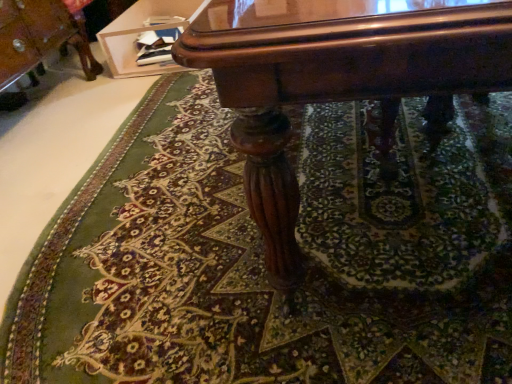
Describe the element at coordinates (143, 32) in the screenshot. I see `wooden glossy vanity at upper center` at that location.

This screenshot has height=384, width=512. What are the coordinates of `wooden glossy vanity at upper center` in the screenshot? It's located at (143, 32).

Measure the distance between wooden glossy vanity at upper center and camera.

wooden glossy vanity at upper center and camera are 8.60 feet apart from each other.

The height and width of the screenshot is (384, 512). Describe the element at coordinates (336, 80) in the screenshot. I see `glossy wood table at center` at that location.

The width and height of the screenshot is (512, 384). Identify the location of glossy wood table at center. (336, 80).

Identify the location of wooden glossy vanity at upper center. This screenshot has width=512, height=384. (143, 32).

Would you say glossy wood table at center is to the left or to the right of wooden glossy vanity at upper center in the picture?

glossy wood table at center is to the right of wooden glossy vanity at upper center.

Is the depth of glossy wood table at center greater than that of wooden glossy vanity at upper center?

No, it is not.

Is point (316, 4) in front of point (183, 25)?

Yes, point (316, 4) is in front of point (183, 25).

From the image's perspective, is glossy wood table at center located above wooden glossy vanity at upper center?

No.

From a real-world perspective, which is physically above, glossy wood table at center or wooden glossy vanity at upper center?

glossy wood table at center.

Considering the relative sizes of glossy wood table at center and wooden glossy vanity at upper center in the image provided, is glossy wood table at center wider than wooden glossy vanity at upper center?

Yes, glossy wood table at center is wider than wooden glossy vanity at upper center.

Based on the photo, between glossy wood table at center and wooden glossy vanity at upper center, which one has less height?

wooden glossy vanity at upper center is shorter.

Does glossy wood table at center have a smaller size compared to wooden glossy vanity at upper center?

Incorrect, glossy wood table at center is not smaller in size than wooden glossy vanity at upper center.

Is wooden glossy vanity at upper center inside glossy wood table at center?

Actually, wooden glossy vanity at upper center is outside glossy wood table at center.

Can you see glossy wood table at center touching wooden glossy vanity at upper center?

No, glossy wood table at center is not touching wooden glossy vanity at upper center.

Is glossy wood table at center turned away from wooden glossy vanity at upper center?

No.

How many degrees apart are the facing directions of glossy wood table at center and wooden glossy vanity at upper center?

179 degrees separate the facing orientations of glossy wood table at center and wooden glossy vanity at upper center.

Measure the distance from glossy wood table at center to wooden glossy vanity at upper center.

7.18 feet.

At what (x,y) coordinates should I click in order to perform the action: click on table on the right of wooden glossy vanity at upper center. Please return your answer as a coordinate pair (x, y). This screenshot has width=512, height=384. Looking at the image, I should click on (336, 80).

Between wooden glossy vanity at upper center and glossy wood table at center, which one appears on the left side from the viewer's perspective?

From the viewer's perspective, wooden glossy vanity at upper center appears more on the left side.

Considering their positions, is wooden glossy vanity at upper center located in front of or behind glossy wood table at center?

wooden glossy vanity at upper center is positioned farther from the viewer than glossy wood table at center.

Between point (119, 51) and point (259, 45), which one is positioned behind?

Positioned behind is point (119, 51).

From the image's perspective, which object appears higher, wooden glossy vanity at upper center or glossy wood table at center?

wooden glossy vanity at upper center.

From a real-world perspective, relative to glossy wood table at center, is wooden glossy vanity at upper center vertically above or below?

In terms of real-world spatial position, wooden glossy vanity at upper center is below glossy wood table at center.

Is wooden glossy vanity at upper center thinner than glossy wood table at center?

Correct, the width of wooden glossy vanity at upper center is less than that of glossy wood table at center.

In the scene shown: Can you confirm if wooden glossy vanity at upper center is taller than glossy wood table at center?

No.

Is wooden glossy vanity at upper center bigger or smaller than glossy wood table at center?

wooden glossy vanity at upper center is smaller than glossy wood table at center.

Could glossy wood table at center be considered to be inside wooden glossy vanity at upper center?

That's incorrect, glossy wood table at center is not inside wooden glossy vanity at upper center.

Is wooden glossy vanity at upper center next to glossy wood table at center and touching it?

No.

Is wooden glossy vanity at upper center positioned with its back to glossy wood table at center?

wooden glossy vanity at upper center is not turned away from glossy wood table at center.

What's the angular difference between wooden glossy vanity at upper center and glossy wood table at center's facing directions?

179 degrees.

Identify the location of table lying on the right of wooden glossy vanity at upper center. This screenshot has height=384, width=512. (336, 80).

You are a GUI agent. You are given a task and a screenshot of the screen. Output one action in this format:
    pyautogui.click(x=<x>, y=<y>)
    Task: Click on the table that is in front of the wooden glossy vanity at upper center
    The image size is (512, 384).
    Given the screenshot: What is the action you would take?
    pyautogui.click(x=336, y=80)

Identify the location of table on the right of wooden glossy vanity at upper center. (336, 80).